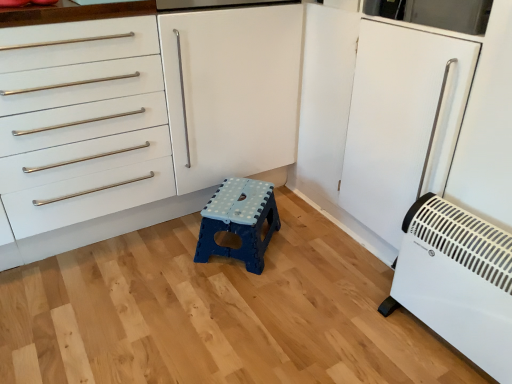
Locate an element on the screen. The width and height of the screenshot is (512, 384). free spot above blue plastic stool at center (from a real-world perspective) is located at coordinates (238, 203).